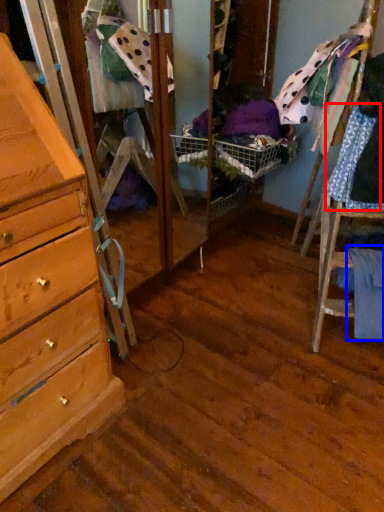
Question: Among these objects, which one is nearest to the camera, clothing (highlighted by a red box) or clothing (highlighted by a blue box)?

Choices:
 (A) clothing
 (B) clothing

Answer: (A)